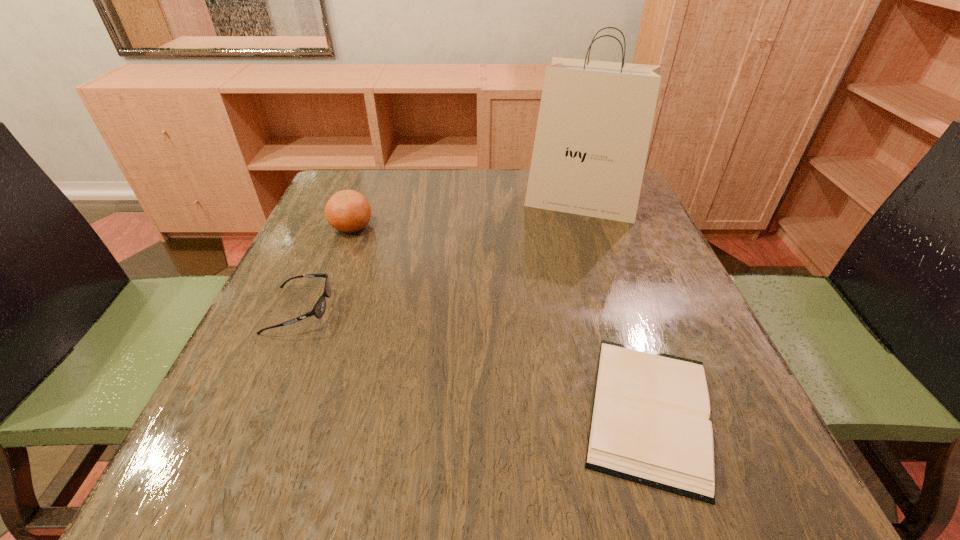
Locate an element on the screen. shopping bag situated at the far edge is located at coordinates (595, 119).

Find the location of a particular element. clementine that is at the far edge is located at coordinates (349, 211).

Where is `object that is at the near edge`? This screenshot has height=540, width=960. object that is at the near edge is located at coordinates (650, 424).

Where is `clementine present at the left edge`? This screenshot has height=540, width=960. clementine present at the left edge is located at coordinates (349, 211).

Where is `sunglasses located at the left edge`? The image size is (960, 540). sunglasses located at the left edge is located at coordinates (318, 310).

You are a GUI agent. You are given a task and a screenshot of the screen. Output one action in this format:
    pyautogui.click(x=<x>, y=<y>)
    Task: Click on the shopping bag positioned at the right edge
    The height and width of the screenshot is (540, 960).
    Given the screenshot: What is the action you would take?
    pyautogui.click(x=595, y=119)

Where is `hardback book located in the right edge section of the desktop`? The height and width of the screenshot is (540, 960). hardback book located in the right edge section of the desktop is located at coordinates (650, 424).

Identify the location of object located at the far left corner. (349, 211).

Locate an element on the screen. This screenshot has width=960, height=540. object at the far right corner is located at coordinates (595, 119).

Where is `object that is at the near right corner`? object that is at the near right corner is located at coordinates (650, 424).